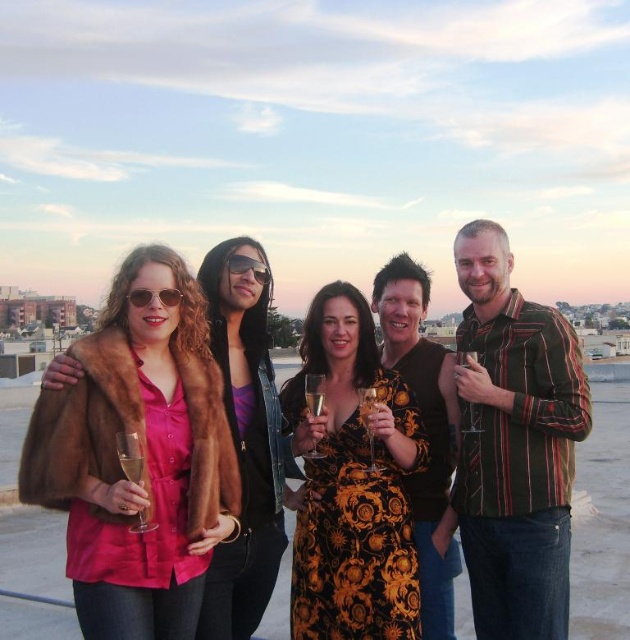
Consider the image. Who is more distant from viewer, (146, 557) or (306, 589)?

The point (306, 589) is more distant.

Can you confirm if matte brown fur coat at center is thinner than floral dress at center?

In fact, matte brown fur coat at center might be wider than floral dress at center.

This screenshot has height=640, width=630. What do you see at coordinates (146, 456) in the screenshot?
I see `matte brown fur coat at center` at bounding box center [146, 456].

The height and width of the screenshot is (640, 630). I want to click on matte brown fur coat at center, so click(146, 456).

Which is above, striped cotton shirt at right or black textured shirt at center?

Positioned higher is striped cotton shirt at right.

Is striped cotton shirt at right wider than black textured shirt at center?

Correct, the width of striped cotton shirt at right exceeds that of black textured shirt at center.

Is point (568, 442) in front of point (428, 403)?

Yes.

Locate an element on the screen. This screenshot has height=640, width=630. striped cotton shirt at right is located at coordinates (513, 444).

Consider the image. Can you confirm if floral dress at center is positioned below black textured shirt at center?

Indeed, floral dress at center is positioned under black textured shirt at center.

Does floral dress at center have a lesser width compared to black textured shirt at center?

Incorrect, floral dress at center's width is not less than black textured shirt at center's.

Where is `floral dress at center`? This screenshot has height=640, width=630. floral dress at center is located at coordinates (352, 481).

Image resolution: width=630 pixels, height=640 pixels. What are the coordinates of `floral dress at center` in the screenshot? It's located at (352, 481).